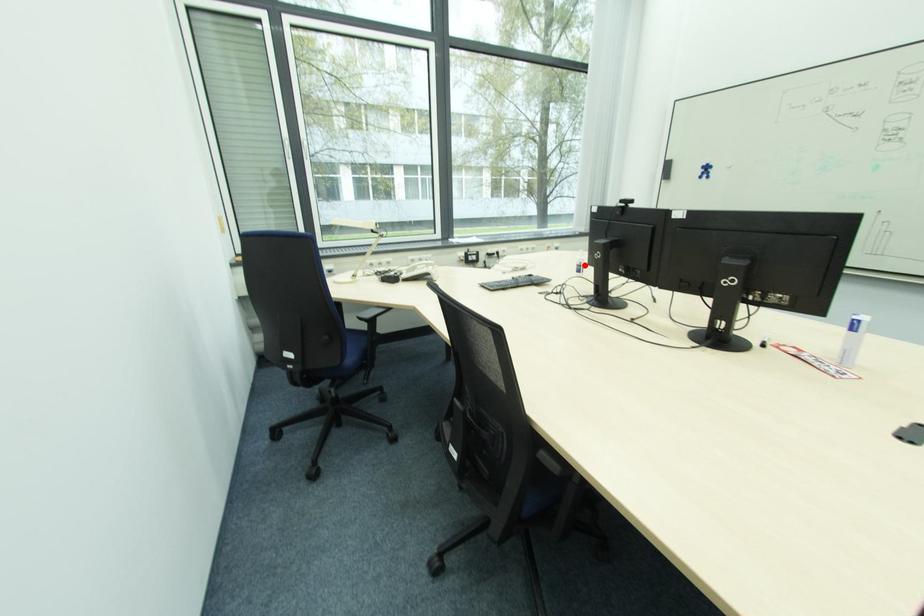
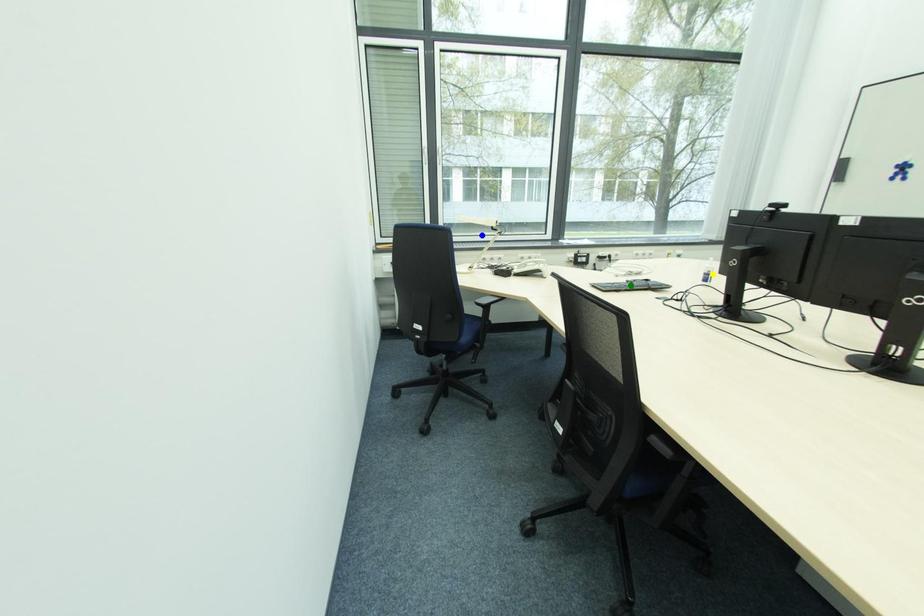
Question: I am providing you with two images of the same scene from different viewpoints. A red point is marked on the first image. You are given multiple points on the second image. Can you choose the point in image 2 that corresponds to the point in image 1?

Choices:
 (A) green point
 (B) yellow point
 (C) blue point

Answer: (B)